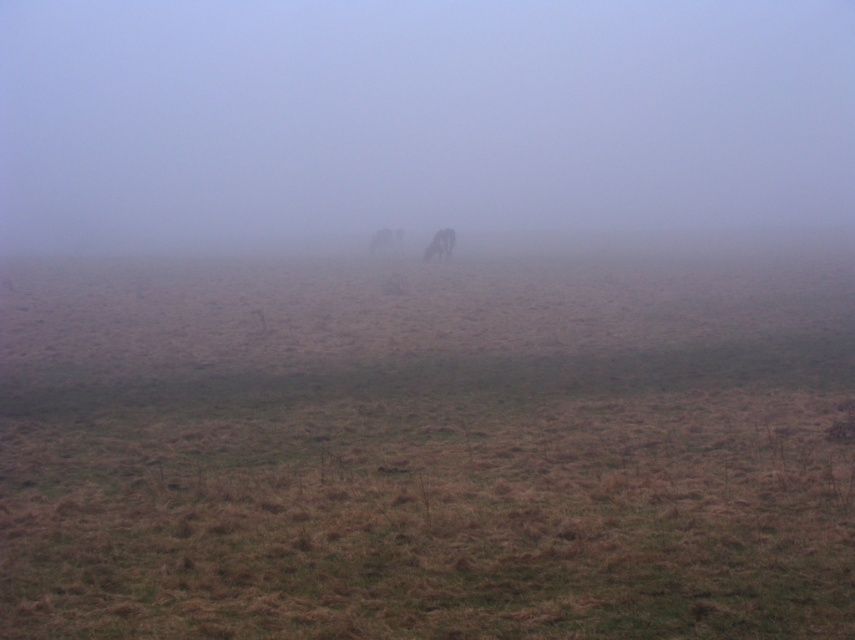
From the picture: Does brown furry dog at center appear on the left side of brown fur horse at center?

Indeed, brown furry dog at center is positioned on the left side of brown fur horse at center.

Is point (370, 246) positioned behind point (450, 230)?

Yes, point (370, 246) is behind point (450, 230).

Image resolution: width=855 pixels, height=640 pixels. I want to click on brown furry dog at center, so click(x=386, y=241).

Between foggy atmosphere at center and brown fur horse at center, which one is positioned higher?

foggy atmosphere at center

Between foggy atmosphere at center and brown fur horse at center, which one is positioned lower?

Positioned lower is brown fur horse at center.

Is point (211, 83) closer to camera compared to point (428, 257)?

That is False.

This screenshot has height=640, width=855. What are the coordinates of `foggy atmosphere at center` in the screenshot? It's located at (417, 116).

Who is shorter, foggy atmosphere at center or brown furry dog at center?

brown furry dog at center

Does foggy atmosphere at center have a smaller size compared to brown furry dog at center?

Incorrect, foggy atmosphere at center is not smaller in size than brown furry dog at center.

Describe the element at coordinates (417, 116) in the screenshot. I see `foggy atmosphere at center` at that location.

Where is `foggy atmosphere at center`? This screenshot has width=855, height=640. foggy atmosphere at center is located at coordinates (417, 116).